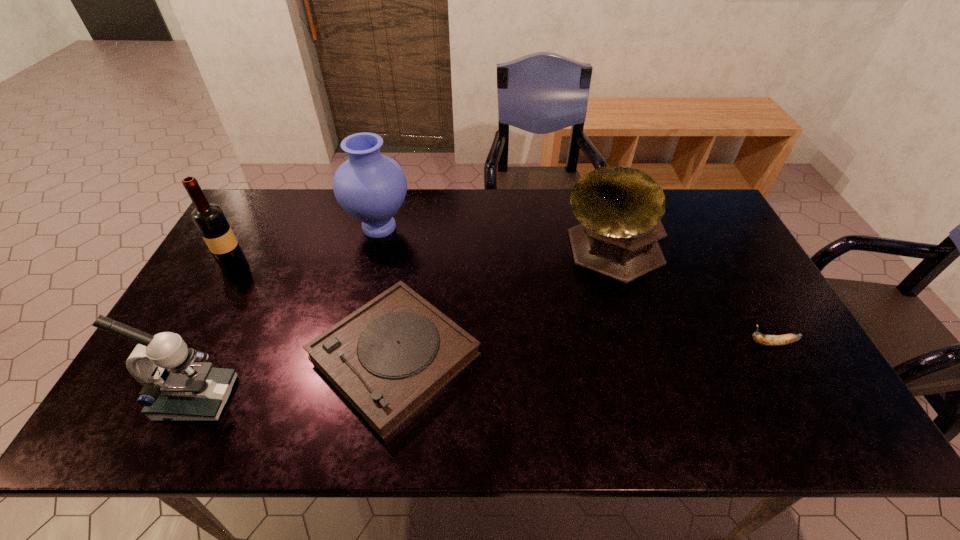
Identify the location of the second object from right to left. This screenshot has height=540, width=960. (620, 208).

Find the location of a particular element. the taller phonograph record is located at coordinates (620, 208).

Locate an element on the screen. The width and height of the screenshot is (960, 540). vase is located at coordinates (371, 187).

Locate an element on the screen. wine bottle is located at coordinates (209, 218).

I want to click on microscope, so click(x=175, y=388).

Locate an element on the screen. The height and width of the screenshot is (540, 960). the rightmost object is located at coordinates (768, 340).

Where is `the shorter phonograph record`? the shorter phonograph record is located at coordinates (388, 358).

Locate an element on the screen. The image size is (960, 540). free region located 0.100m on the horn direction of the taller phonograph record is located at coordinates (630, 322).

The width and height of the screenshot is (960, 540). In order to click on vacant region located on the front of the vase in this screenshot , I will do `click(366, 282)`.

Locate an element on the screen. free location located on the back of the wine bottle is located at coordinates (251, 238).